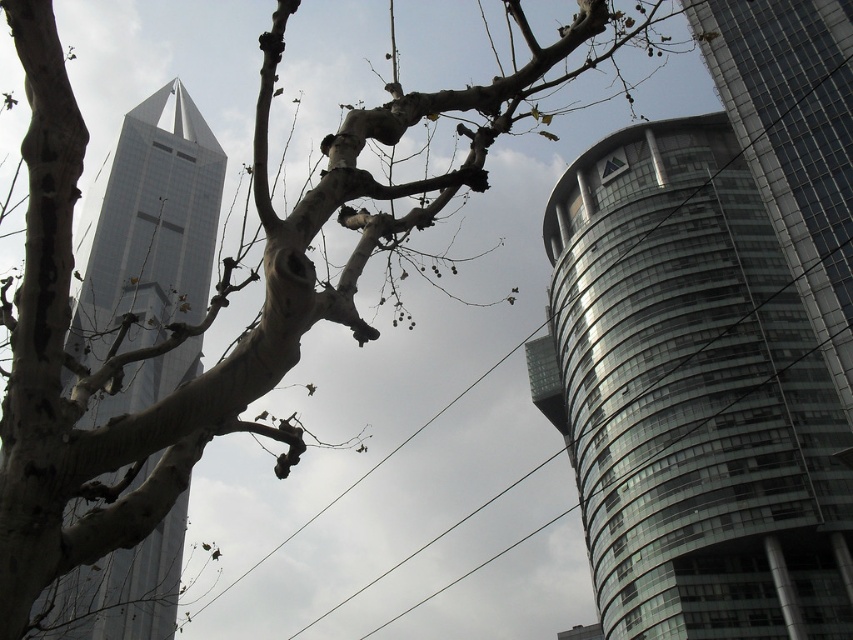
Does glassy silver skyscraper at left have a greater height compared to transparent wire at upper center?

Yes.

What do you see at coordinates (148, 228) in the screenshot? I see `glassy silver skyscraper at left` at bounding box center [148, 228].

Locate an element on the screen. This screenshot has width=853, height=640. glassy silver skyscraper at left is located at coordinates (148, 228).

How far apart are transparent wire at upper center and black wire at center?

transparent wire at upper center and black wire at center are 81.58 feet apart from each other.

Is point (534, 330) less distant than point (366, 588)?

Yes, it is in front of point (366, 588).

Where is `transparent wire at upper center`? This screenshot has height=640, width=853. transparent wire at upper center is located at coordinates (364, 474).

From the picture: Is glassy reflective tower at center above black wire at center?

Correct, glassy reflective tower at center is located above black wire at center.

The image size is (853, 640). What are the coordinates of `glassy reflective tower at center` in the screenshot? It's located at (714, 340).

Where is `glassy reflective tower at center`? The image size is (853, 640). glassy reflective tower at center is located at coordinates (714, 340).